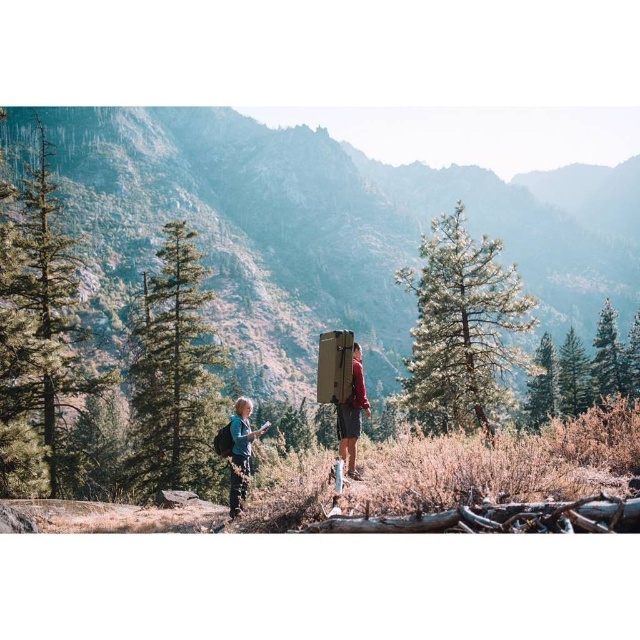
Question: Which object is positioned closest to the brown wooden sign at center?

Choices:
 (A) green matte pine at upper right
 (B) blue denim jacket at center
 (C) green matte pine at left

Answer: (A)

Question: Does brown wooden sign at center appear under blue denim jacket at center?

Choices:
 (A) yes
 (B) no

Answer: (B)

Question: Estimate the real-world distances between objects in this image. Which object is closer to the green matte pine at left?

Choices:
 (A) blue denim jacket at center
 (B) red fabric backpack at center
 (C) green textured pine at center

Answer: (A)

Question: Can you confirm if brown wooden sign at center is positioned below green matte pine at left?

Choices:
 (A) yes
 (B) no

Answer: (B)

Question: In this image, where is green matte pine at upper right located relative to red fabric backpack at center?

Choices:
 (A) left
 (B) right

Answer: (B)

Question: Which point is farther to the camera?

Choices:
 (A) brown wooden sign at center
 (B) green matte pine at upper right
 (C) red fabric backpack at center
 (D) blue denim jacket at center

Answer: (A)